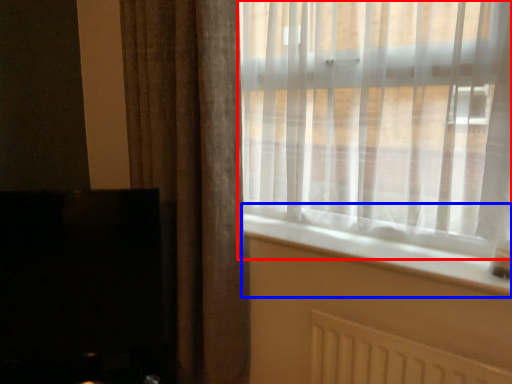
Question: Which point is further to the camera, window (highlighted by a red box) or window sill (highlighted by a blue box)?

Choices:
 (A) window
 (B) window sill

Answer: (B)